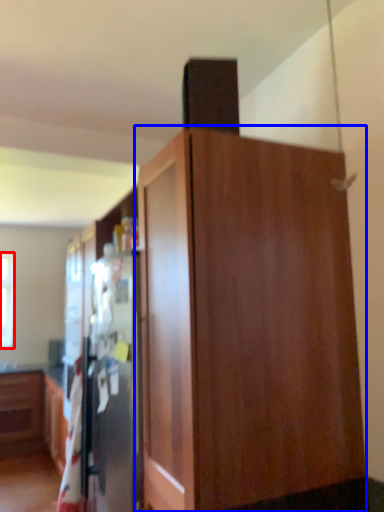
Question: Which object appears farthest to the camera in this image, window (highlighted by a red box) or cupboard (highlighted by a blue box)?

Choices:
 (A) window
 (B) cupboard

Answer: (A)